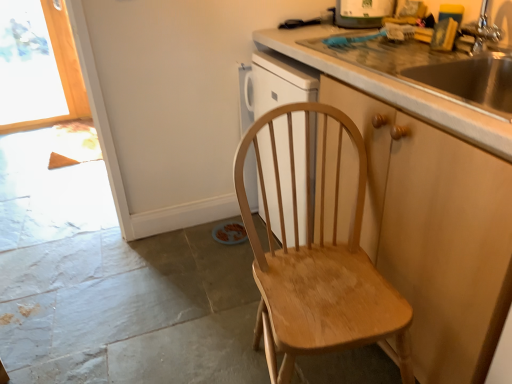
Question: Is point (389, 1) positioned closer to the camera than point (352, 241)?

Choices:
 (A) farther
 (B) closer

Answer: (A)

Question: From a real-world perspective, is white glossy dishwasher at upper center physically located above or below light brown wooden chair at center?

Choices:
 (A) above
 (B) below

Answer: (A)

Question: Estimate the real-world distances between objects in this image. Which object is farther from the light brown wooden chair at center?

Choices:
 (A) silver metallic faucet at upper right
 (B) transparent glass window at upper left
 (C) wooden cabinet at right
 (D) white glossy dishwasher at upper center

Answer: (B)

Question: Which object is the closest to the white glossy dishwasher at upper center?

Choices:
 (A) silver metallic faucet at upper right
 (B) transparent glass window at upper left
 (C) wooden cabinet at right
 (D) light brown wooden chair at center

Answer: (A)